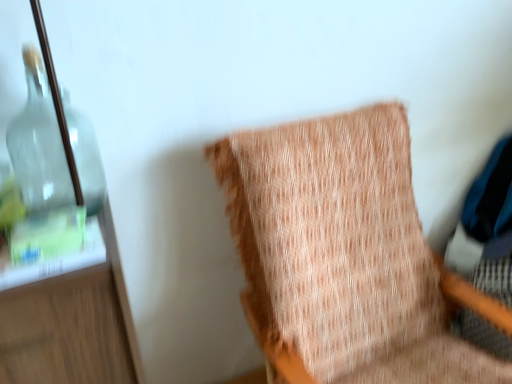
Question: Considering their positions, is textured peach fabric at center located in front of or behind transparent glass bottle at left?

Choices:
 (A) behind
 (B) front

Answer: (B)

Question: Visually, is textured peach fabric at center positioned to the left or to the right of transparent glass bottle at left?

Choices:
 (A) right
 (B) left

Answer: (A)

Question: From a real-world perspective, is textured peach fabric at center positioned above or below transparent glass bottle at left?

Choices:
 (A) below
 (B) above

Answer: (A)

Question: In terms of width, does transparent glass bottle at left look wider or thinner when compared to textured peach fabric at center?

Choices:
 (A) wide
 (B) thin

Answer: (B)

Question: From a real-world perspective, is transparent glass bottle at left physically located above or below textured peach fabric at center?

Choices:
 (A) below
 (B) above

Answer: (B)

Question: Is point (76, 137) positioned closer to the camera than point (367, 317)?

Choices:
 (A) closer
 (B) farther

Answer: (A)

Question: From the image's perspective, relative to textured peach fabric at center, is transparent glass bottle at left above or below?

Choices:
 (A) above
 (B) below

Answer: (A)